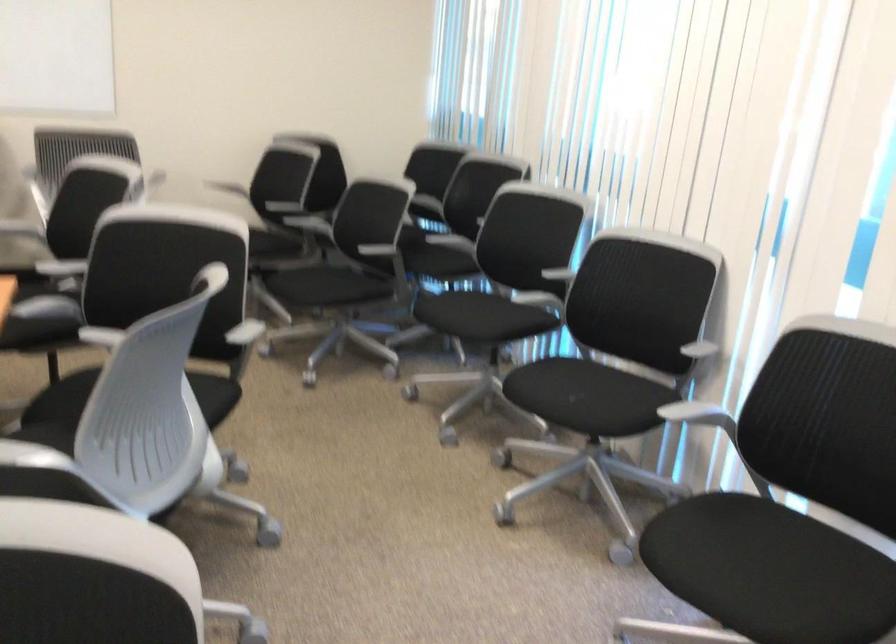
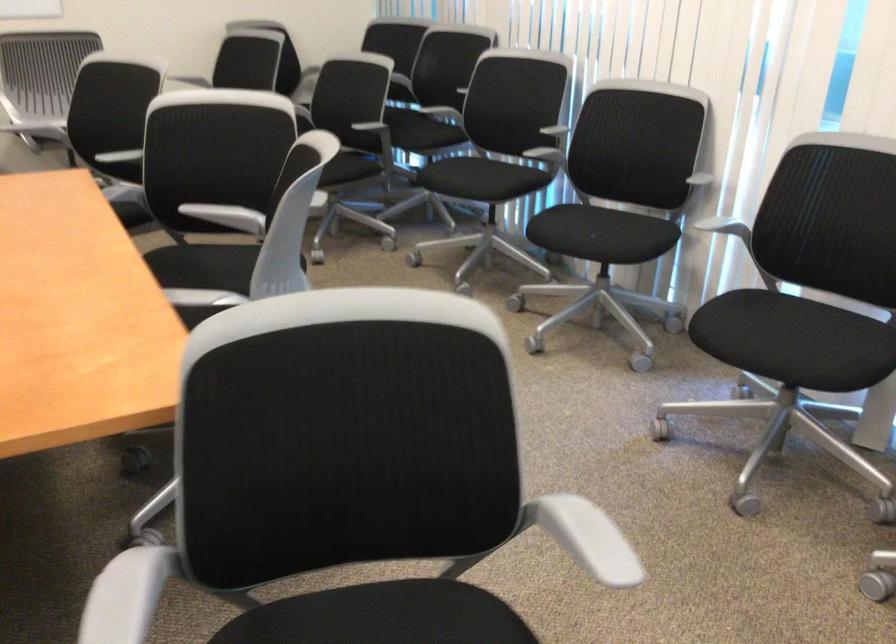
Where in the second image is the point corresponding to pixel 475 321 from the first image?

(480, 178)